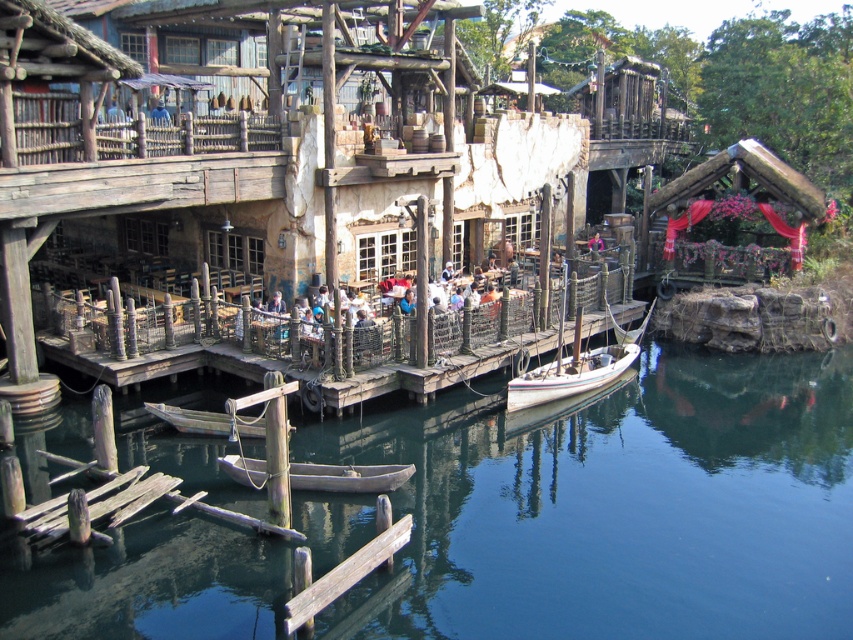
You are a visitor at the waterfront and want to take a photo of both the smooth dark blue water at center and the white wooden boat at center. Since you have a wide angle lens, can you capture both objects in one frame without moving your camera position?

The smooth dark blue water at center is bigger than the white wooden boat at center, so yes, you can capture both in one frame since the water takes up more space and the boat is smaller, allowing them to fit together within the lens range.

You are standing at the edge of the waterfront scene in the medieval theme area. You see wooden planks at center. Can you determine their exact position using coordinates?

The wooden planks at center are located at coordinates point [433,371].